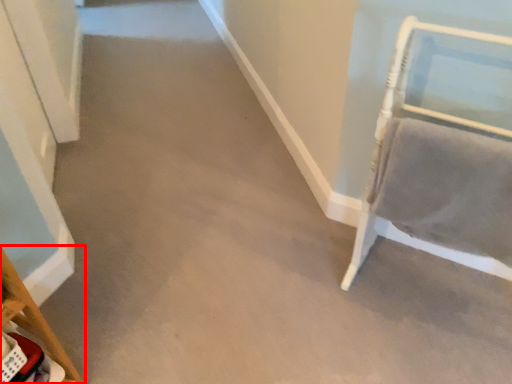
Question: In this image, where is furniture (annotated by the red box) located relative to furniture?

Choices:
 (A) left
 (B) right

Answer: (A)